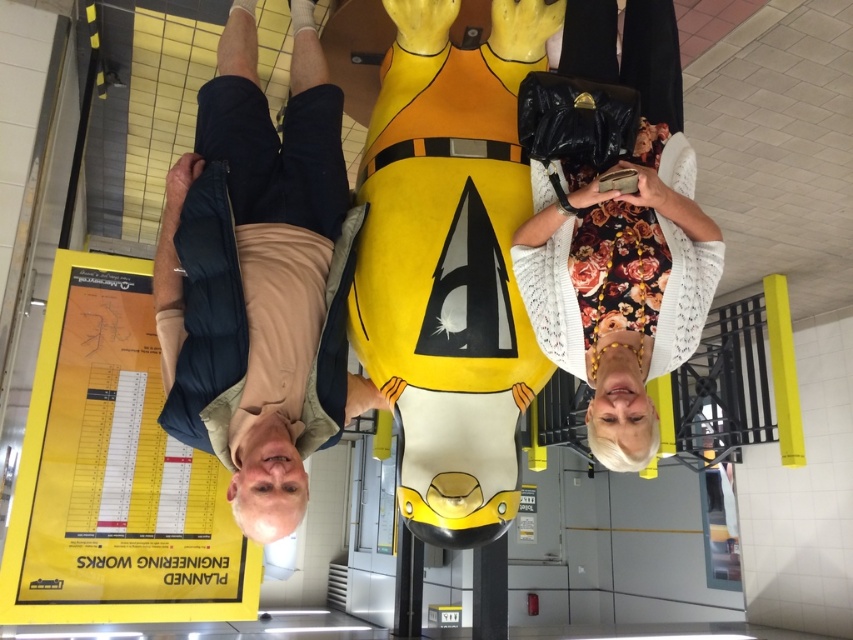
You are standing in a train station and see the yellow paper poster at lower left. Where exactly is it positioned relative to the yellow and black sculpture in the center?

The yellow paper poster at lower left is located at point (114, 474) relative to the yellow and black sculpture in the center.

You are standing in a public transit area with a large yellow and black sculpture in the center. You see a beige fabric shirt at center and a floral dress at center. Which clothing item is wider?

The beige fabric shirt at center might be wider than floral dress at center according to the description.

You are a delivery person who needs to hang a new poster higher than the beige fabric shirt at center. Can the yellow paper poster at lower left be placed in its current position to meet this requirement?

The yellow paper poster at lower left is not as tall as the beige fabric shirt at center, so placing it in its current position would not meet the requirement since it is shorter than the shirt.